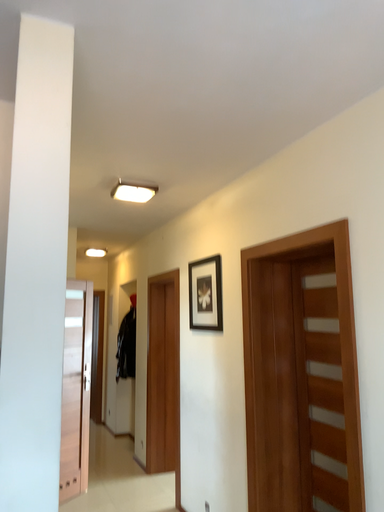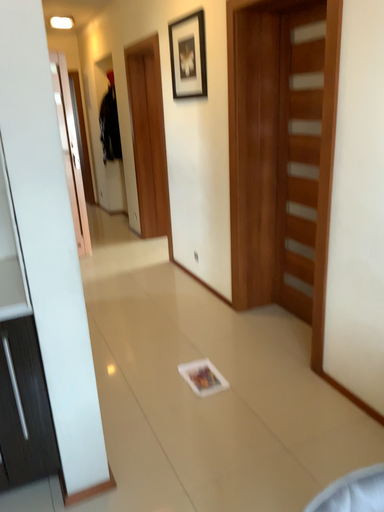
Question: Which way did the camera rotate in the video?

Choices:
 (A) rotated downward
 (B) rotated upward

Answer: (A)